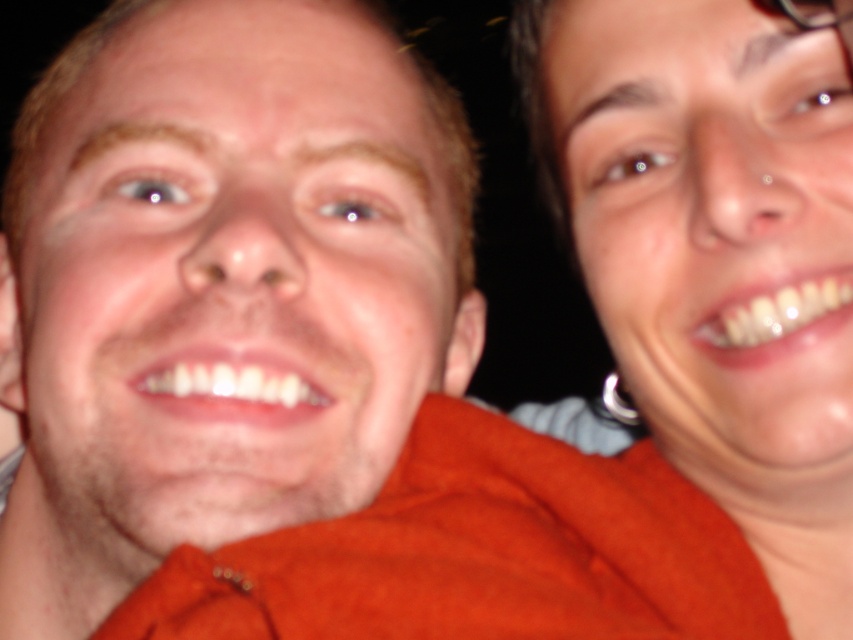
How distant is matte orange shirt at left from matte skin at right?

They are 6.39 inches apart.

Which of these two, matte orange shirt at left or matte skin at right, stands taller?

matte orange shirt at left

Is point (281, 179) closer to viewer compared to point (759, 400)?

That is False.

I want to click on matte orange shirt at left, so click(229, 280).